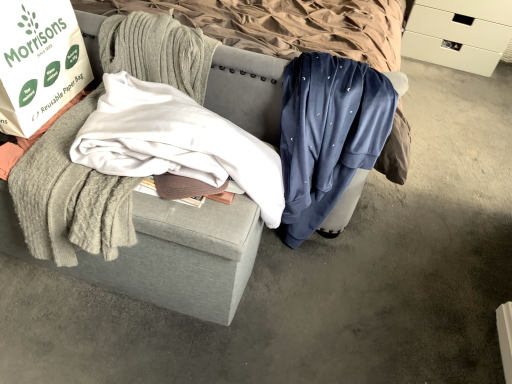
Question: Looking at the image, does white paper bag at left seem bigger or smaller compared to textured gray ottoman at center?

Choices:
 (A) big
 (B) small

Answer: (B)

Question: Is white paper bag at left in front of or behind textured gray ottoman at center in the image?

Choices:
 (A) behind
 (B) front

Answer: (B)

Question: Which object is positioned closest to the white paper bag at left?

Choices:
 (A) velvet blue sweatpants at center, acting as the 1th clothing starting from the right
 (B) white cotton shirt at center, the second clothing when ordered from right to left
 (C) white matte drawer at upper right
 (D) textured gray ottoman at center

Answer: (B)

Question: Based on their relative distances, which object is nearer to the velvet blue sweatpants at center, which is counted as the second clothing, starting from the left?

Choices:
 (A) white cotton shirt at center, the second clothing when ordered from right to left
 (B) textured gray ottoman at center
 (C) white matte drawer at upper right
 (D) white paper bag at left

Answer: (A)